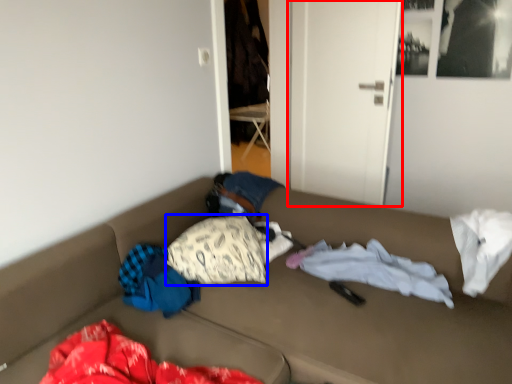
Question: Which object is further to the camera taking this photo, door (highlighted by a red box) or pillow (highlighted by a blue box)?

Choices:
 (A) door
 (B) pillow

Answer: (A)